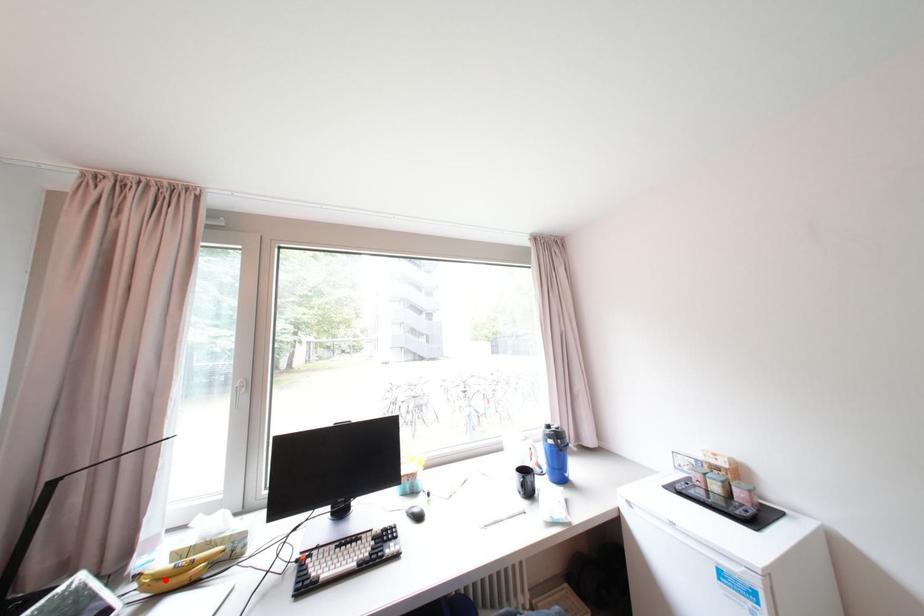
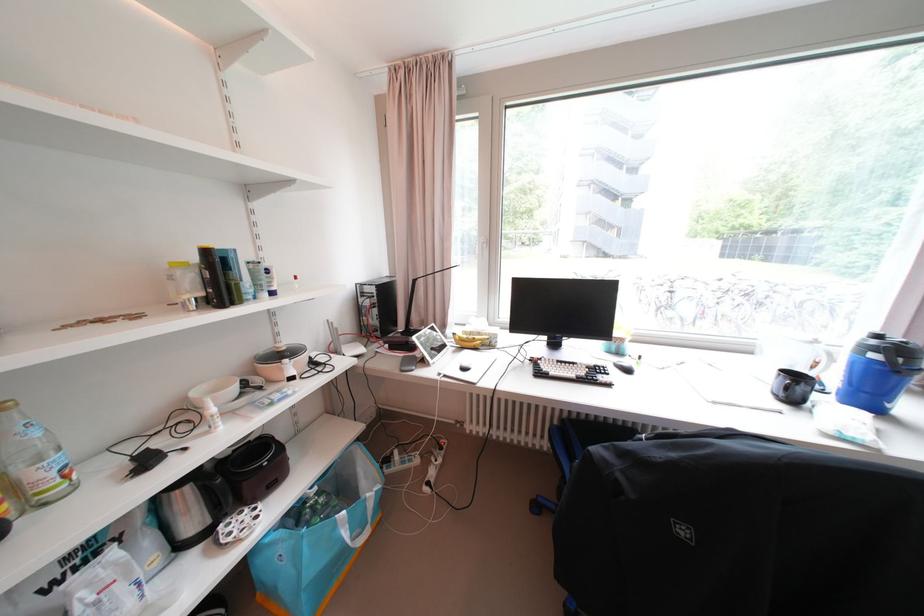
Find the pixel in the second image that matches the highlighted location in the first image.

(468, 341)